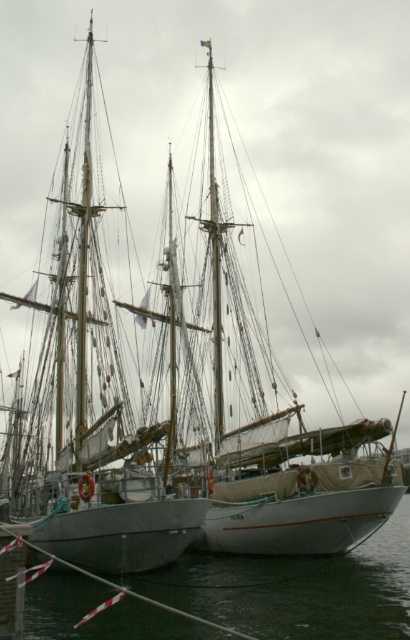
Does wooden sailboat at left have a greater height compared to black rubber water at lower center?

Correct, wooden sailboat at left is much taller as black rubber water at lower center.

Is wooden sailboat at left above black rubber water at lower center?

Correct, wooden sailboat at left is located above black rubber water at lower center.

Is point (73, 141) closer to viewer compared to point (220, 634)?

No, it is behind (220, 634).

Find the location of `wooden sailboat at left`. wooden sailboat at left is located at coordinates (97, 388).